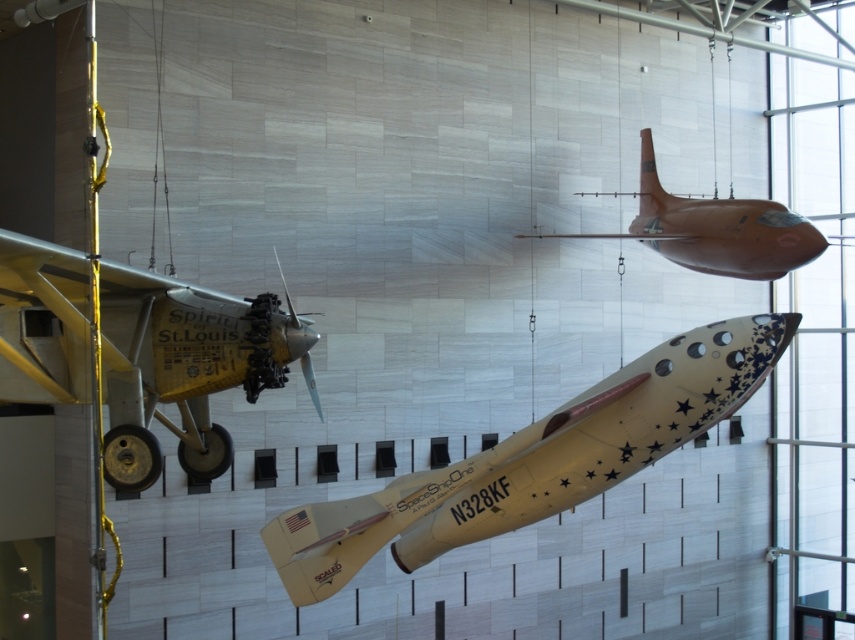
Question: Is white glossy rocket at center positioned at the back of matte orange airplane at upper right?

Choices:
 (A) yes
 (B) no

Answer: (B)

Question: Does white glossy rocket at center appear on the left side of yellow matte airplane at left?

Choices:
 (A) yes
 (B) no

Answer: (B)

Question: Does white glossy rocket at center appear on the right side of metallic silver propeller at center?

Choices:
 (A) no
 (B) yes

Answer: (B)

Question: Which point is closer to the camera?

Choices:
 (A) (706, 204)
 (B) (652, 396)

Answer: (B)

Question: Which of the following is the farthest from the observer?

Choices:
 (A) (315, 403)
 (B) (653, 179)
 (C) (137, 486)
 (D) (705, 406)

Answer: (B)

Question: Among these objects, which one is nearest to the camera?

Choices:
 (A) matte orange airplane at upper right
 (B) metallic silver propeller at center

Answer: (B)